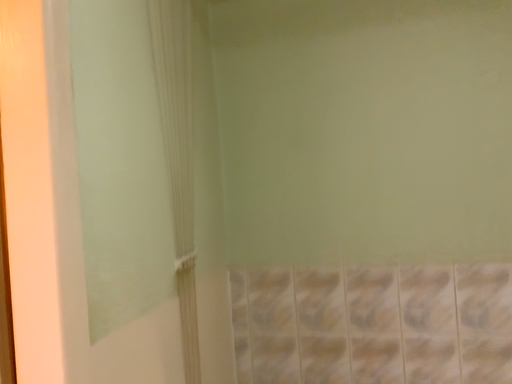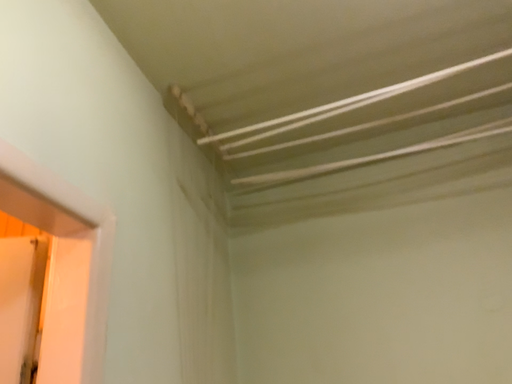
Question: How did the camera likely rotate when shooting the video?

Choices:
 (A) rotated downward
 (B) rotated upward

Answer: (B)